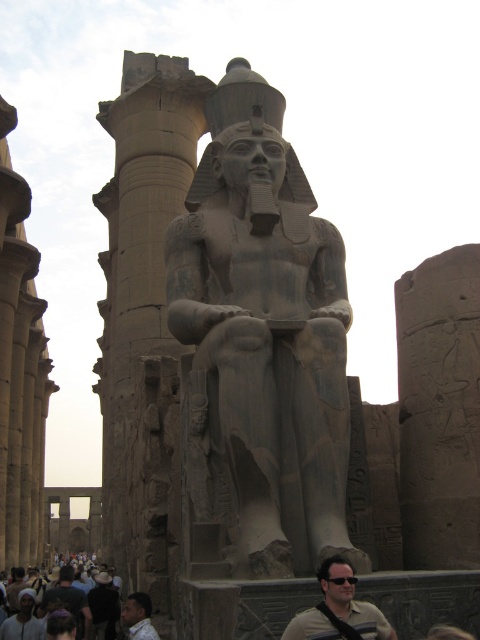
Question: Is tan fabric shirt at center positioned in front of light brown skin at center?

Choices:
 (A) yes
 (B) no

Answer: (A)

Question: Can you confirm if dark brown leather jacket at lower left is positioned below black plastic goggles at center?

Choices:
 (A) yes
 (B) no

Answer: (A)

Question: Is dark brown hair at center smaller than light brown skin at center?

Choices:
 (A) no
 (B) yes

Answer: (A)

Question: Which point is closer to the camera?

Choices:
 (A) (81, 608)
 (B) (348, 579)
 (C) (22, 611)

Answer: (B)

Question: Which point is closer to the camera?

Choices:
 (A) tan fabric shirt at center
 (B) dark brown leather jacket at lower left
 (C) dark brown leather jacket at center
 (D) light brown skin at center

Answer: (A)

Question: Which point appears farthest from the camera in this image?

Choices:
 (A) (382, 630)
 (B) (124, 381)

Answer: (B)